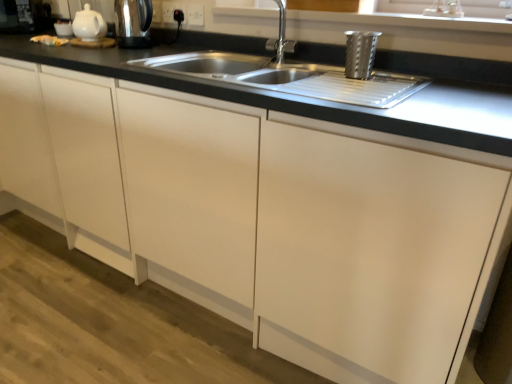
I want to click on empty space that is to the right of metallic stainless steel kettle at upper left, the second appliance when ordered from right to left, so click(x=176, y=54).